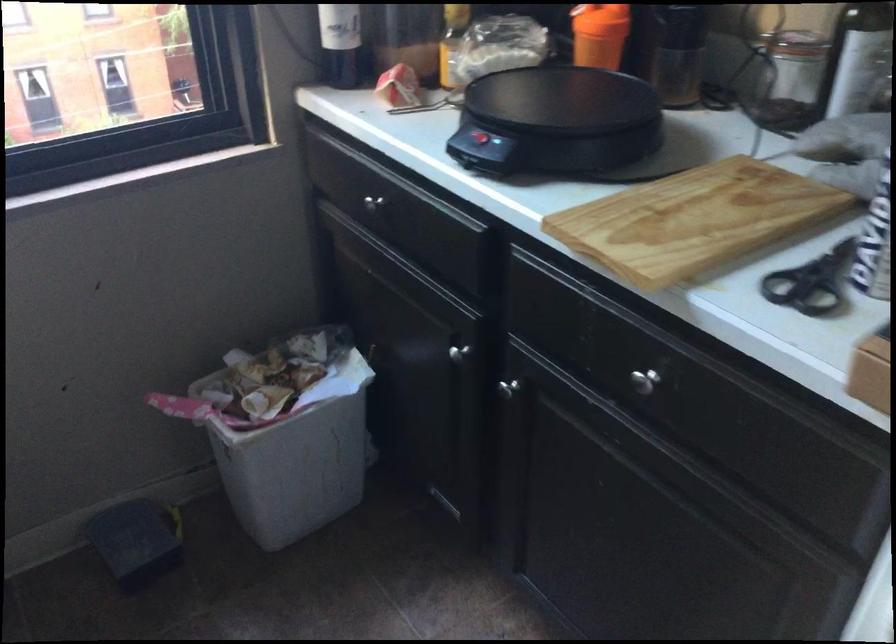
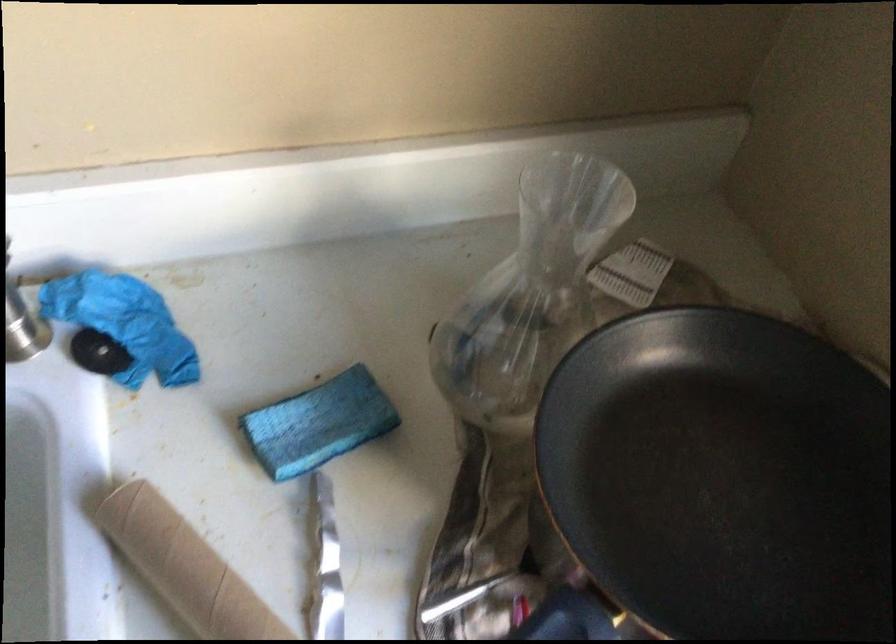
The images are taken continuously from a first-person perspective. In which direction is your viewpoint rotating?

The camera rotated toward left-down.